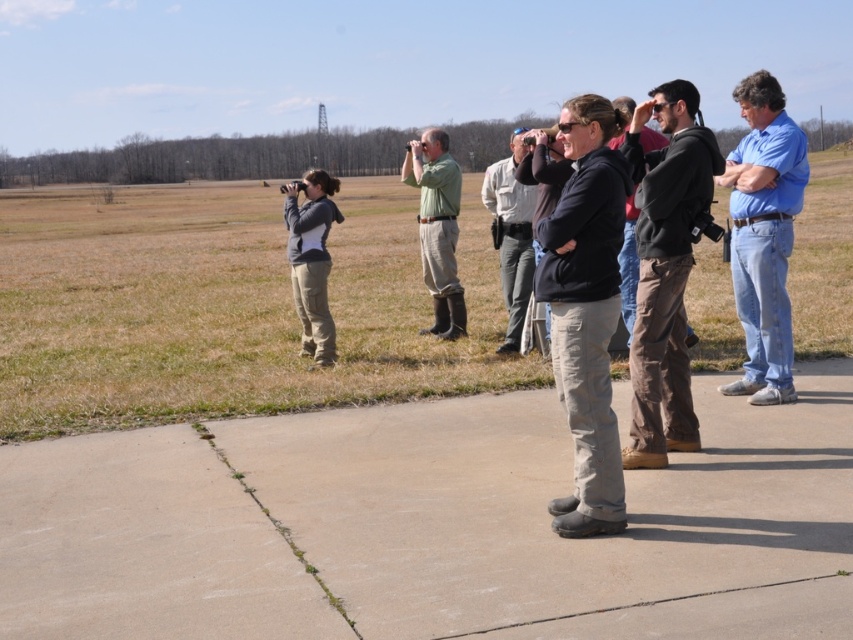
Question: Is the position of green grass at center less distant than that of dark brown leather pants at center?

Choices:
 (A) yes
 (B) no

Answer: (B)

Question: Among these objects, which one is farthest from the camera?

Choices:
 (A) gray fleece jacket at left
 (B) dark gray jacket at center

Answer: (A)

Question: Considering the real-world distances, which object is closest to the dark brown leather pants at center?

Choices:
 (A) dark gray jacket at center
 (B) dark gray hoodie at center
 (C) green grass at center

Answer: (B)

Question: Which point is closer to the camera?

Choices:
 (A) (329, 356)
 (B) (461, 368)

Answer: (B)

Question: Is blue denim jeans at right to the left of green rubber boots at center from the viewer's perspective?

Choices:
 (A) no
 (B) yes

Answer: (A)

Question: Is green grass at center above dark gray hoodie at center?

Choices:
 (A) yes
 (B) no

Answer: (A)